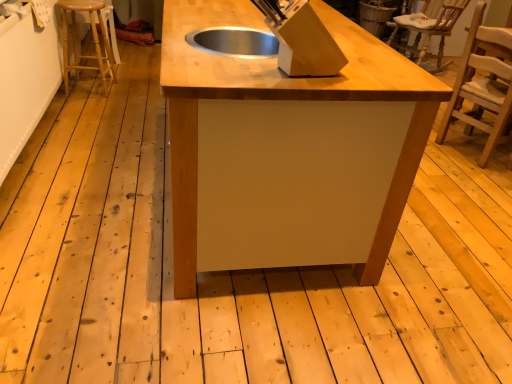
In order to click on free space that is in between matte wood table at center and light brown wooden stool at left in this screenshot , I will do `click(120, 140)`.